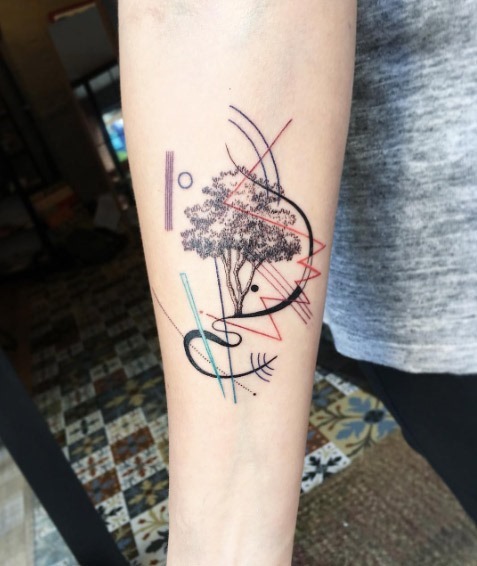
I want to click on floor, so click(128, 417).